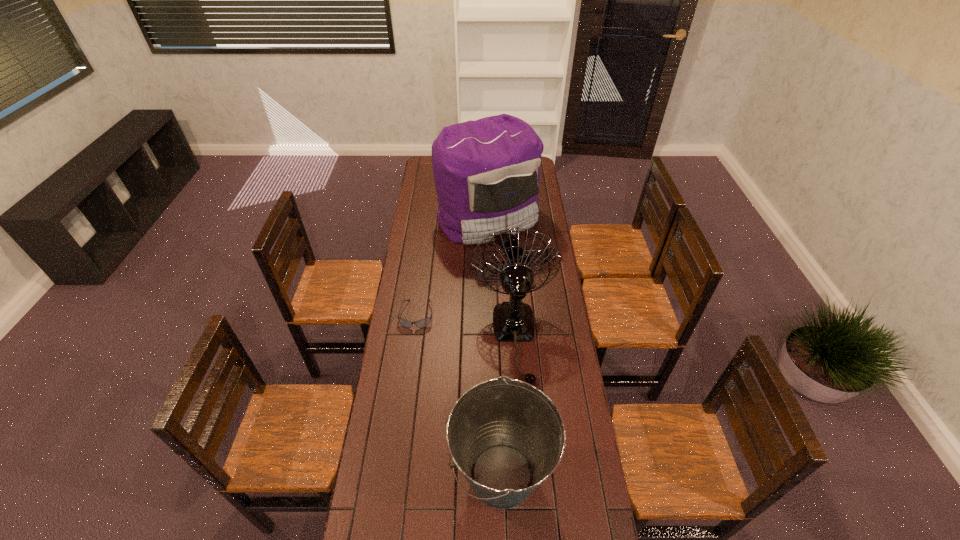
You are a GUI agent. You are given a task and a screenshot of the screen. Output one action in this format:
    pyautogui.click(x=<x>, y=<y>)
    Task: Click on the vacant area that lies between the shortest object and the bucket
    The image size is (960, 540).
    Given the screenshot: What is the action you would take?
    pyautogui.click(x=459, y=395)

What are the coordinates of `vacant area that lies between the farthest object and the bucket` in the screenshot? It's located at coord(494,347).

Find the location of `unoccupied position between the sunglasses and the backpack`. unoccupied position between the sunglasses and the backpack is located at coordinates (452, 266).

At what (x,y) coordinates should I click in order to perform the action: click on vacant area between the third tallest object and the backpack. Please return your answer as a coordinate pair (x, y). The width and height of the screenshot is (960, 540). Looking at the image, I should click on (494, 347).

At what (x,y) coordinates should I click in order to perform the action: click on unoccupied position between the fan and the sunglasses. Please return your answer as a coordinate pair (x, y). The image size is (960, 540). Looking at the image, I should click on (466, 326).

Point out which object is positioned as the second nearest to the backpack. Please provide its 2D coordinates. Your answer should be formatted as a tuple, i.e. [(x, y)], where the tuple contains the x and y coordinates of a point satisfying the conditions above.

[(425, 322)]

The height and width of the screenshot is (540, 960). What are the coordinates of `object that is the third closest to the farthest object` in the screenshot? It's located at (507, 437).